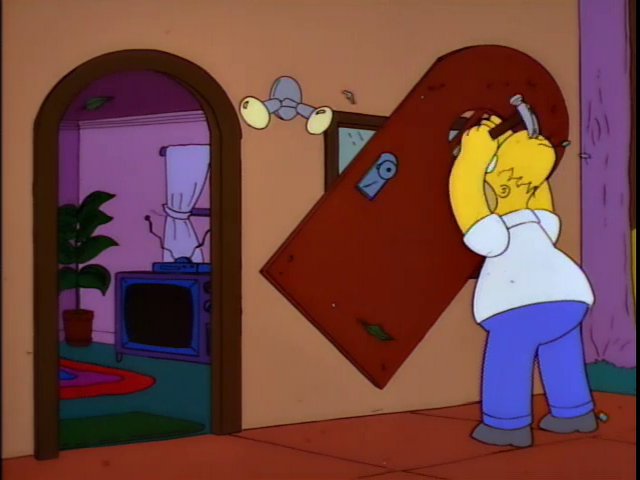
Identify the location of curtain. (192, 172).